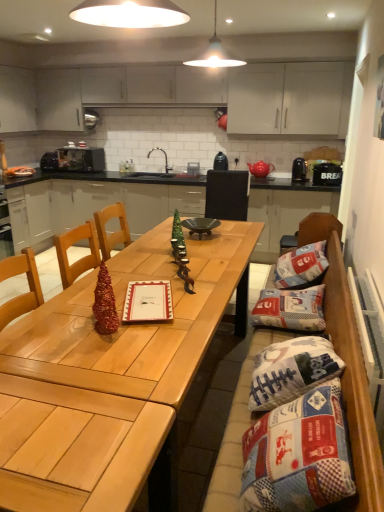
Find the location of `vacant position to the left of shiny metallic christmas tree at center, positioned as the 1th christmas tree in bottom-to-top order`. vacant position to the left of shiny metallic christmas tree at center, positioned as the 1th christmas tree in bottom-to-top order is located at coordinates (59, 327).